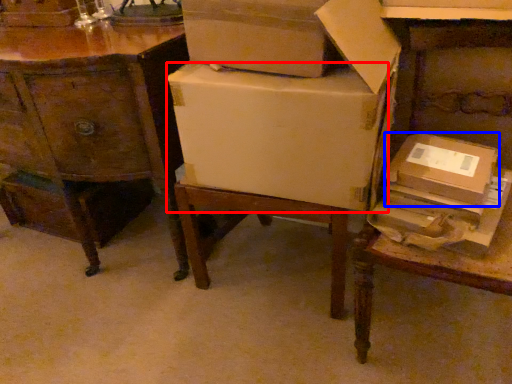
Question: Which object appears closest to the camera in this image, cardboard box (highlighted by a red box) or cardboard box (highlighted by a blue box)?

Choices:
 (A) cardboard box
 (B) cardboard box

Answer: (A)